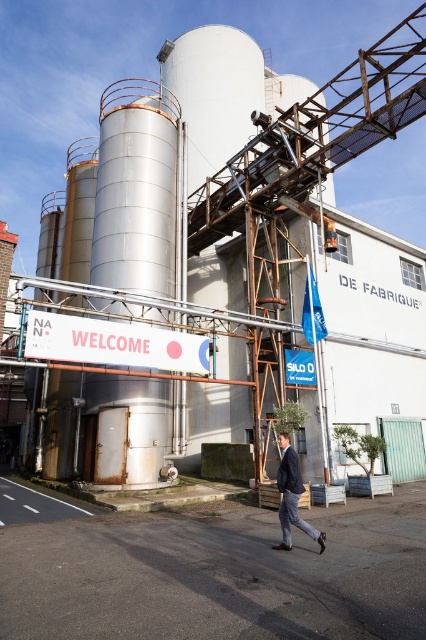
You are a tour guide leading a group through the industrial site. You notice the metallic silo at center and the dark gray suit at center. Which object is wider?

The metallic silo at center is wider than the dark gray suit at center, as its width surpasses the suit.

You are an employee arriving at the industrial site and notice the metallic silo at center and the dark gray suit at center. Which object is positioned higher from the ground?

The metallic silo at center is located above the dark gray suit at center, so the metallic silo at center is positioned higher from the ground.

You are standing at the entrance of the industrial site and see two points marked in the scene. The first point is at coordinates point (227,176) and the second point is at point (278,474). Which point is closer to you?

Point (227,176) is further to the camera than point (278,474), so the second point is closer to you.